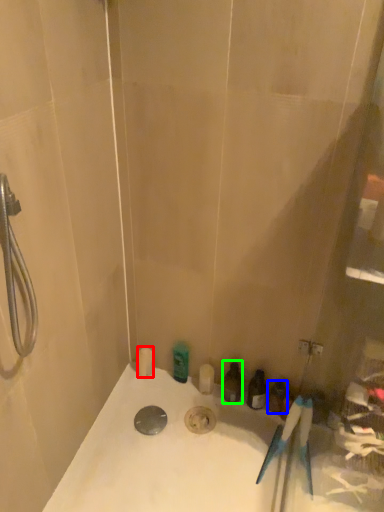
Question: Which object is the closest to the toiletry (highlighted by a red box)? Choose among these: toiletry (highlighted by a blue box) or toiletry (highlighted by a green box).

Choices:
 (A) toiletry
 (B) toiletry

Answer: (B)